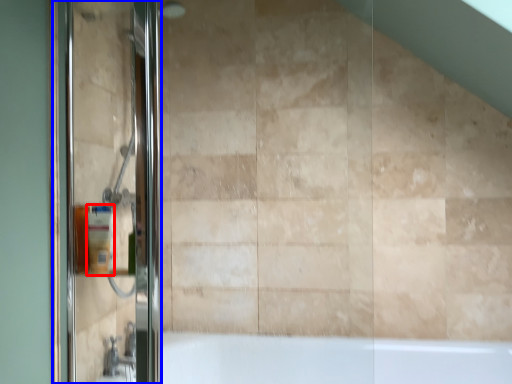
Question: Which object appears farthest to the camera in this image, toiletry (highlighted by a red box) or screen door (highlighted by a blue box)?

Choices:
 (A) toiletry
 (B) screen door

Answer: (A)